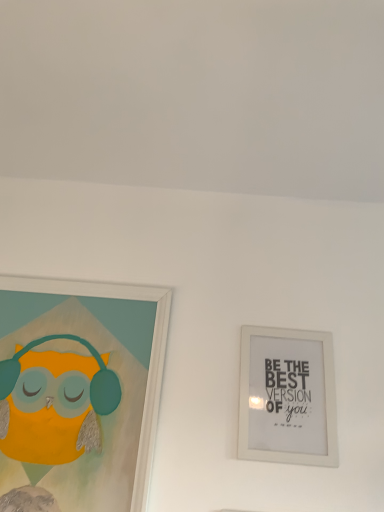
This screenshot has width=384, height=512. Describe the element at coordinates (79, 393) in the screenshot. I see `matte white picture frame at left, marked as the second picture frame in a right-to-left arrangement` at that location.

In order to face matte white picture frame at left, marked as the 1th picture frame in a left-to-right arrangement, should I rotate leftwards or rightwards?

Rotate left and turn 16.502 degrees.

Image resolution: width=384 pixels, height=512 pixels. In order to click on matte white picture frame at left, marked as the second picture frame in a right-to-left arrangement in this screenshot , I will do `click(79, 393)`.

Where is `white matte picture frame at upper right, positioned as the 2th picture frame in left-to-right order`? Image resolution: width=384 pixels, height=512 pixels. white matte picture frame at upper right, positioned as the 2th picture frame in left-to-right order is located at coordinates click(287, 397).

Measure the distance between point (287,345) and camera.

The depth of point (287,345) is 3.86 feet.

The width and height of the screenshot is (384, 512). What do you see at coordinates (287, 397) in the screenshot?
I see `white matte picture frame at upper right, positioned as the 2th picture frame in left-to-right order` at bounding box center [287, 397].

The width and height of the screenshot is (384, 512). Find the location of `matte white picture frame at left, marked as the 1th picture frame in a left-to-right arrangement`. matte white picture frame at left, marked as the 1th picture frame in a left-to-right arrangement is located at coordinates 79,393.

Which is more to the right, matte white picture frame at left, marked as the 1th picture frame in a left-to-right arrangement, or white matte picture frame at upper right, which is counted as the first picture frame, starting from the right?

white matte picture frame at upper right, which is counted as the first picture frame, starting from the right, is more to the right.

Is matte white picture frame at left, marked as the 1th picture frame in a left-to-right arrangement, further to the viewer compared to white matte picture frame at upper right, positioned as the 2th picture frame in left-to-right order?

No, matte white picture frame at left, marked as the 1th picture frame in a left-to-right arrangement, is closer to the camera.

Does point (163, 289) lie in front of point (304, 350)?

No, (163, 289) is behind (304, 350).

From the image's perspective, is matte white picture frame at left, marked as the 1th picture frame in a left-to-right arrangement, above or below white matte picture frame at upper right, positioned as the 2th picture frame in left-to-right order?

Based on their image positions, matte white picture frame at left, marked as the 1th picture frame in a left-to-right arrangement, is located above white matte picture frame at upper right, positioned as the 2th picture frame in left-to-right order.

In the scene shown: From a real-world perspective, which object stands above the other?

white matte picture frame at upper right, positioned as the 2th picture frame in left-to-right order, is physically above.

Is matte white picture frame at left, marked as the second picture frame in a right-to-left arrangement, thinner than white matte picture frame at upper right, positioned as the 2th picture frame in left-to-right order?

No, matte white picture frame at left, marked as the second picture frame in a right-to-left arrangement, is not thinner than white matte picture frame at upper right, positioned as the 2th picture frame in left-to-right order.

Considering the sizes of objects matte white picture frame at left, marked as the 1th picture frame in a left-to-right arrangement, and white matte picture frame at upper right, which is counted as the first picture frame, starting from the right, in the image provided, who is shorter, matte white picture frame at left, marked as the 1th picture frame in a left-to-right arrangement, or white matte picture frame at upper right, which is counted as the first picture frame, starting from the right,?

With less height is white matte picture frame at upper right, which is counted as the first picture frame, starting from the right.

Is matte white picture frame at left, marked as the second picture frame in a right-to-left arrangement, smaller than white matte picture frame at upper right, positioned as the 2th picture frame in left-to-right order?

No.

Is matte white picture frame at left, marked as the 1th picture frame in a left-to-right arrangement, surrounding white matte picture frame at upper right, which is counted as the first picture frame, starting from the right?

No.

Is matte white picture frame at left, marked as the 1th picture frame in a left-to-right arrangement, touching white matte picture frame at upper right, which is counted as the first picture frame, starting from the right?

No, matte white picture frame at left, marked as the 1th picture frame in a left-to-right arrangement, is not in contact with white matte picture frame at upper right, which is counted as the first picture frame, starting from the right.

Is matte white picture frame at left, marked as the second picture frame in a right-to-left arrangement, facing towards white matte picture frame at upper right, positioned as the 2th picture frame in left-to-right order?

No, matte white picture frame at left, marked as the second picture frame in a right-to-left arrangement, is not aimed at white matte picture frame at upper right, positioned as the 2th picture frame in left-to-right order.

How many degrees apart are the facing directions of matte white picture frame at left, marked as the 1th picture frame in a left-to-right arrangement, and white matte picture frame at upper right, positioned as the 2th picture frame in left-to-right order?

There is a 0.00303-degree angle between the facing directions of matte white picture frame at left, marked as the 1th picture frame in a left-to-right arrangement, and white matte picture frame at upper right, positioned as the 2th picture frame in left-to-right order.

Identify the location of picture frame beneath the white matte picture frame at upper right, which is counted as the first picture frame, starting from the right (from a real-world perspective). (79, 393).

In the image, is white matte picture frame at upper right, positioned as the 2th picture frame in left-to-right order, on the left side or the right side of matte white picture frame at left, marked as the 1th picture frame in a left-to-right arrangement?

Based on their positions, white matte picture frame at upper right, positioned as the 2th picture frame in left-to-right order, is located to the right of matte white picture frame at left, marked as the 1th picture frame in a left-to-right arrangement.

Considering the positions of objects white matte picture frame at upper right, positioned as the 2th picture frame in left-to-right order, and matte white picture frame at left, marked as the second picture frame in a right-to-left arrangement, in the image provided, who is in front, white matte picture frame at upper right, positioned as the 2th picture frame in left-to-right order, or matte white picture frame at left, marked as the second picture frame in a right-to-left arrangement,?

matte white picture frame at left, marked as the second picture frame in a right-to-left arrangement, is closer to the camera.

Considering the points (276, 348) and (45, 292), which point is behind, point (276, 348) or point (45, 292)?

Point (45, 292)

From the image's perspective, between white matte picture frame at upper right, which is counted as the first picture frame, starting from the right, and matte white picture frame at left, marked as the second picture frame in a right-to-left arrangement, who is located below?

white matte picture frame at upper right, which is counted as the first picture frame, starting from the right, is shown below in the image.

From a real-world perspective, is white matte picture frame at upper right, which is counted as the first picture frame, starting from the right, positioned over matte white picture frame at left, marked as the second picture frame in a right-to-left arrangement, based on gravity?

Yes, from a real-world perspective, white matte picture frame at upper right, which is counted as the first picture frame, starting from the right, is on top of matte white picture frame at left, marked as the second picture frame in a right-to-left arrangement.

Considering the relative sizes of white matte picture frame at upper right, which is counted as the first picture frame, starting from the right, and matte white picture frame at left, marked as the 1th picture frame in a left-to-right arrangement, in the image provided, is white matte picture frame at upper right, which is counted as the first picture frame, starting from the right, wider than matte white picture frame at left, marked as the 1th picture frame in a left-to-right arrangement,?

No.

Can you confirm if white matte picture frame at upper right, which is counted as the first picture frame, starting from the right, is shorter than matte white picture frame at left, marked as the 1th picture frame in a left-to-right arrangement?

Correct, white matte picture frame at upper right, which is counted as the first picture frame, starting from the right, is not as tall as matte white picture frame at left, marked as the 1th picture frame in a left-to-right arrangement.

Between white matte picture frame at upper right, which is counted as the first picture frame, starting from the right, and matte white picture frame at left, marked as the second picture frame in a right-to-left arrangement, which one has smaller size?

With smaller size is white matte picture frame at upper right, which is counted as the first picture frame, starting from the right.

Would you say white matte picture frame at upper right, which is counted as the first picture frame, starting from the right, is outside matte white picture frame at left, marked as the 1th picture frame in a left-to-right arrangement?

That's correct, white matte picture frame at upper right, which is counted as the first picture frame, starting from the right, is outside of matte white picture frame at left, marked as the 1th picture frame in a left-to-right arrangement.

Is the surface of white matte picture frame at upper right, which is counted as the first picture frame, starting from the right, in direct contact with matte white picture frame at left, marked as the 1th picture frame in a left-to-right arrangement?

No, white matte picture frame at upper right, which is counted as the first picture frame, starting from the right, is not touching matte white picture frame at left, marked as the 1th picture frame in a left-to-right arrangement.

Is white matte picture frame at upper right, positioned as the 2th picture frame in left-to-right order, turned away from matte white picture frame at left, marked as the second picture frame in a right-to-left arrangement?

No, white matte picture frame at upper right, positioned as the 2th picture frame in left-to-right order,'s orientation is not away from matte white picture frame at left, marked as the second picture frame in a right-to-left arrangement.

What's the angular difference between white matte picture frame at upper right, which is counted as the first picture frame, starting from the right, and matte white picture frame at left, marked as the second picture frame in a right-to-left arrangement,'s facing directions?

The angle between the facing direction of white matte picture frame at upper right, which is counted as the first picture frame, starting from the right, and the facing direction of matte white picture frame at left, marked as the second picture frame in a right-to-left arrangement, is 0.00303 degrees.

From the picture: Measure the distance from white matte picture frame at upper right, which is counted as the first picture frame, starting from the right, to matte white picture frame at left, marked as the second picture frame in a right-to-left arrangement.

white matte picture frame at upper right, which is counted as the first picture frame, starting from the right, is 15.40 inches away from matte white picture frame at left, marked as the second picture frame in a right-to-left arrangement.

Identify the location of picture frame above the white matte picture frame at upper right, positioned as the 2th picture frame in left-to-right order (from the image's perspective). The width and height of the screenshot is (384, 512). (79, 393).

This screenshot has width=384, height=512. I want to click on picture frame above the matte white picture frame at left, marked as the 1th picture frame in a left-to-right arrangement (from a real-world perspective), so click(x=287, y=397).

Image resolution: width=384 pixels, height=512 pixels. In the image, there is a matte white picture frame at left, marked as the 1th picture frame in a left-to-right arrangement. Identify the location of picture frame below it (from the image's perspective). (287, 397).